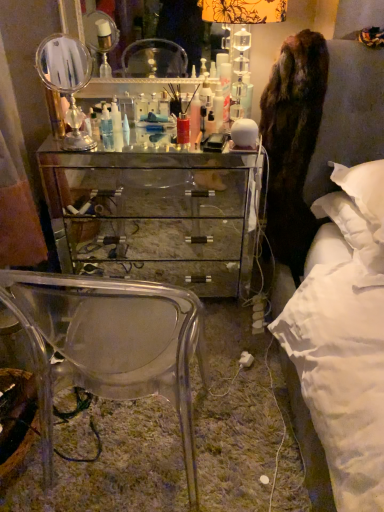
In order to face white fluffy pillow at right, should I rotate leftwards or rightwards?

Turn right approximately 21.722 degrees to face it.

Find the location of a particular element. mirrored glass chest of drawers at center is located at coordinates (155, 215).

This screenshot has height=512, width=384. What do you see at coordinates (155, 215) in the screenshot?
I see `mirrored glass chest of drawers at center` at bounding box center [155, 215].

In order to face orange fabric lampshade at upper right, should I rotate leftwards or rightwards?

You should look right and rotate roughly 6.230 degrees.

Find the location of a particular element. Image resolution: width=384 pixels, height=512 pixels. white fluffy pillow at right is located at coordinates (344, 234).

Is translucent plastic bottle at center, which ranks as the 1th toiletry in left-to-right order, taller or shorter than brown furry coat at right?

Considering their sizes, translucent plastic bottle at center, which ranks as the 1th toiletry in left-to-right order, has less height than brown furry coat at right.

Which object is wider, translucent plastic bottle at center, which ranks as the 1th toiletry in left-to-right order, or brown furry coat at right?

With larger width is brown furry coat at right.

Which object is wider, clear glass drawer at center or brown furry coat at right?

Wider between the two is brown furry coat at right.

Consider the image. From a real-world perspective, relative to brown furry coat at right, is clear glass drawer at center vertically above or below?

clear glass drawer at center is below brown furry coat at right.

Locate an element on the screen. fur coat in front of the clear glass drawer at center is located at coordinates (293, 143).

Which is in front, point (92, 133) or point (278, 0)?

Point (92, 133)

Considering the relative sizes of translucent plastic bottle at center, which ranks as the 1th toiletry in left-to-right order, and orange fabric lampshade at upper right in the image provided, is translucent plastic bottle at center, which ranks as the 1th toiletry in left-to-right order, smaller than orange fabric lampshade at upper right?

Yes, translucent plastic bottle at center, which ranks as the 1th toiletry in left-to-right order, is smaller than orange fabric lampshade at upper right.

Which is more to the left, translucent plastic bottle at center, which ranks as the 1th toiletry in left-to-right order, or orange fabric lampshade at upper right?

From the viewer's perspective, translucent plastic bottle at center, which ranks as the 1th toiletry in left-to-right order, appears more on the left side.

Does translucent plastic bottle at center, arranged as the third toiletry when viewed from the right, come behind orange fabric lampshade at upper right?

Yes.

Is clear plastic bottle at center, the second toiletry from the left, located within transparent acrylic chair at center?

Result: No.

From a real-world perspective, is transparent acrylic chair at center physically below clear plastic bottle at center, the second toiletry from the left?

Yes, from a real-world perspective, transparent acrylic chair at center is under clear plastic bottle at center, the second toiletry from the left.

From the image's perspective, which object appears higher, transparent acrylic chair at center or clear plastic bottle at center, the second toiletry from the left?

clear plastic bottle at center, the second toiletry from the left.

Is transparent acrylic chair at center taller than clear plastic bottle at center, arranged as the 2th toiletry when viewed from the right?

Indeed, transparent acrylic chair at center has a greater height compared to clear plastic bottle at center, arranged as the 2th toiletry when viewed from the right.

Based on their sizes in the image, would you say transparent acrylic chair at center is bigger or smaller than white fluffy pillow at right?

Considering their sizes, transparent acrylic chair at center takes up more space than white fluffy pillow at right.

Is transparent acrylic chair at center at the left side of white fluffy pillow at right?

Yes.

From the image's perspective, relative to white fluffy pillow at right, is transparent acrylic chair at center above or below?

transparent acrylic chair at center is below white fluffy pillow at right.

Is transparent acrylic chair at center inside or outside of white fluffy pillow at right?

transparent acrylic chair at center is spatially situated outside white fluffy pillow at right.

In terms of size, does white glossy bottle at center, the third toiletry positioned from the left, appear bigger or smaller than orange fabric lampshade at upper right?

Clearly, white glossy bottle at center, the third toiletry positioned from the left, is smaller in size than orange fabric lampshade at upper right.

From the image's perspective, which is below, white glossy bottle at center, the third toiletry positioned from the left, or orange fabric lampshade at upper right?

white glossy bottle at center, the third toiletry positioned from the left.

Between white glossy bottle at center, the third toiletry positioned from the left, and orange fabric lampshade at upper right, which one appears on the left side from the viewer's perspective?

From the viewer's perspective, white glossy bottle at center, the third toiletry positioned from the left, appears more on the left side.

From the picture: Is orange fabric lampshade at upper right surrounded by white glossy bottle at center, the third toiletry positioned from the left?

Definitely not — orange fabric lampshade at upper right is not inside white glossy bottle at center, the third toiletry positioned from the left.

Who is more distant, orange fabric lampshade at upper right or clear acrylic mirror at center, acting as the 1th mirror starting from the back?

clear acrylic mirror at center, acting as the 1th mirror starting from the back, is further away from the camera.

Considering the sizes of objects orange fabric lampshade at upper right and clear acrylic mirror at center, the second mirror from the bottom, in the image provided, who is wider, orange fabric lampshade at upper right or clear acrylic mirror at center, the second mirror from the bottom,?

orange fabric lampshade at upper right is wider.

From the image's perspective, who appears lower, orange fabric lampshade at upper right or clear acrylic mirror at center, the first mirror from the top?

orange fabric lampshade at upper right.

From a real-world perspective, is orange fabric lampshade at upper right located beneath clear acrylic mirror at center, acting as the 1th mirror starting from the back?

Yes.

Locate an element on the screen. This screenshot has height=512, width=384. the 1st toiletry above the brown furry coat at right (from a real-world perspective) is located at coordinates (94, 125).

Identify the location of drawer that is behind the brown furry coat at right. (155, 239).

From the image, which object appears to be nearer to white fluffy pillow at right, clear acrylic mirror at center, the second mirror from the bottom, or translucent plastic bottle at center, arranged as the third toiletry when viewed from the right?

translucent plastic bottle at center, arranged as the third toiletry when viewed from the right, is closer to white fluffy pillow at right.

Based on the photo, based on their spatial positions, is mirrored glass chest of drawers at center or orange fabric lampshade at upper right closer to clear plastic bottle at center, the second toiletry from the left?

mirrored glass chest of drawers at center.

Considering their positions, is mirrored glass chest of drawers at center positioned further to translucent plastic bottle at center, arranged as the third toiletry when viewed from the right, than white fluffy pillow at right?

Among the two, white fluffy pillow at right is located further to translucent plastic bottle at center, arranged as the third toiletry when viewed from the right.

Looking at the image, which one is located further to brown furry coat at right, orange fabric lampshade at upper right or clear glass drawer at center?

Based on the image, clear glass drawer at center appears to be further to brown furry coat at right.

When comparing their distances from orange fabric lampshade at upper right, does brown furry coat at right or clear plastic bottle at center, the second toiletry from the left, seem further?

clear plastic bottle at center, the second toiletry from the left, is further to orange fabric lampshade at upper right.

Estimate the real-world distances between objects in this image. Which object is closer to translucent plastic bottle at center, arranged as the third toiletry when viewed from the right, clear glass drawer at center or orange fabric lampshade at upper right?

orange fabric lampshade at upper right is positioned closer to the anchor translucent plastic bottle at center, arranged as the third toiletry when viewed from the right.

Looking at the image, which one is located closer to brown furry coat at right, silver metallic mirror at upper left, the second mirror from the top, or clear glass drawer at center?

Among the two, silver metallic mirror at upper left, the second mirror from the top, is located nearer to brown furry coat at right.

Considering their positions, is clear plastic bottle at center, the second toiletry from the left, positioned further to mirrored glass chest of drawers at center than white glossy bottle at center, which is the 1th toiletry from right to left?

Among the two, white glossy bottle at center, which is the 1th toiletry from right to left, is located further to mirrored glass chest of drawers at center.

Find the location of `mirror located between translucent plastic bottle at center, arranged as the third toiletry when viewed from the right, and orange fabric lampshade at upper right in the left-right direction`. mirror located between translucent plastic bottle at center, arranged as the third toiletry when viewed from the right, and orange fabric lampshade at upper right in the left-right direction is located at coordinates (186, 29).

You are a GUI agent. You are given a task and a screenshot of the screen. Output one action in this format:
    pyautogui.click(x=<x>, y=<y>)
    Task: Click on the fur coat between clear acrylic mirror at center, the second mirror from the bottom, and mirrored glass chest of drawers at center vertically
    
    Given the screenshot: What is the action you would take?
    pyautogui.click(x=293, y=143)

The image size is (384, 512). Find the location of `the chest of drawers located between silver metallic mirror at upper left, the 1th mirror positioned from the bottom, and clear plastic bottle at center, the second toiletry from the left, in the depth direction`. the chest of drawers located between silver metallic mirror at upper left, the 1th mirror positioned from the bottom, and clear plastic bottle at center, the second toiletry from the left, in the depth direction is located at coordinates (155, 215).

Image resolution: width=384 pixels, height=512 pixels. I want to click on fur coat between mirrored glass chest of drawers at center and white fluffy pillow at right in the horizontal direction, so click(x=293, y=143).